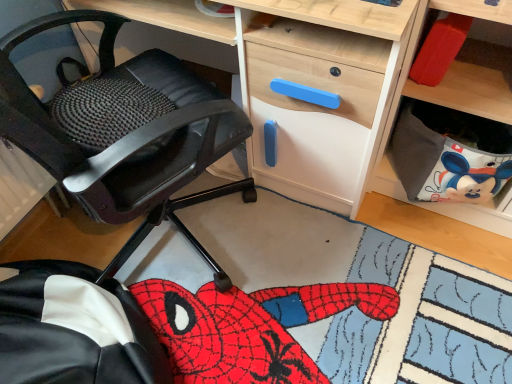
Question: Would you consider black leather chair at left to be distant from wooden desk at center?

Choices:
 (A) yes
 (B) no

Answer: (B)

Question: Is black leather chair at left further to the viewer compared to wooden desk at center?

Choices:
 (A) no
 (B) yes

Answer: (A)

Question: Can you confirm if black leather chair at left is bigger than wooden desk at center?

Choices:
 (A) no
 (B) yes

Answer: (B)

Question: From the image's perspective, is black leather chair at left under wooden desk at center?

Choices:
 (A) yes
 (B) no

Answer: (A)

Question: Is black leather chair at left positioned in front of wooden desk at center?

Choices:
 (A) no
 (B) yes

Answer: (B)

Question: Is point tap(494, 253) positioned closer to the camera than point tap(118, 18)?

Choices:
 (A) farther
 (B) closer

Answer: (A)

Question: Is wooden desk at center situated inside black leather chair at left or outside?

Choices:
 (A) inside
 (B) outside

Answer: (B)

Question: Is wooden desk at center bigger or smaller than black leather chair at left?

Choices:
 (A) small
 (B) big

Answer: (A)

Question: From their relative heights in the image, would you say wooden desk at center is taller or shorter than black leather chair at left?

Choices:
 (A) tall
 (B) short

Answer: (B)

Question: In terms of width, does black leather chair at left look wider or thinner when compared to gray fabric bag at lower right?

Choices:
 (A) wide
 (B) thin

Answer: (A)

Question: Is black leather chair at left in front of or behind gray fabric bag at lower right in the image?

Choices:
 (A) front
 (B) behind

Answer: (A)

Question: In the image, is black leather chair at left on the left side or the right side of gray fabric bag at lower right?

Choices:
 (A) right
 (B) left

Answer: (B)

Question: From the image's perspective, relative to gray fabric bag at lower right, is black leather chair at left above or below?

Choices:
 (A) above
 (B) below

Answer: (A)

Question: Is gray fabric bag at lower right to the left or to the right of wooden desk at center in the image?

Choices:
 (A) left
 (B) right

Answer: (B)

Question: In terms of height, does gray fabric bag at lower right look taller or shorter compared to wooden desk at center?

Choices:
 (A) tall
 (B) short

Answer: (B)